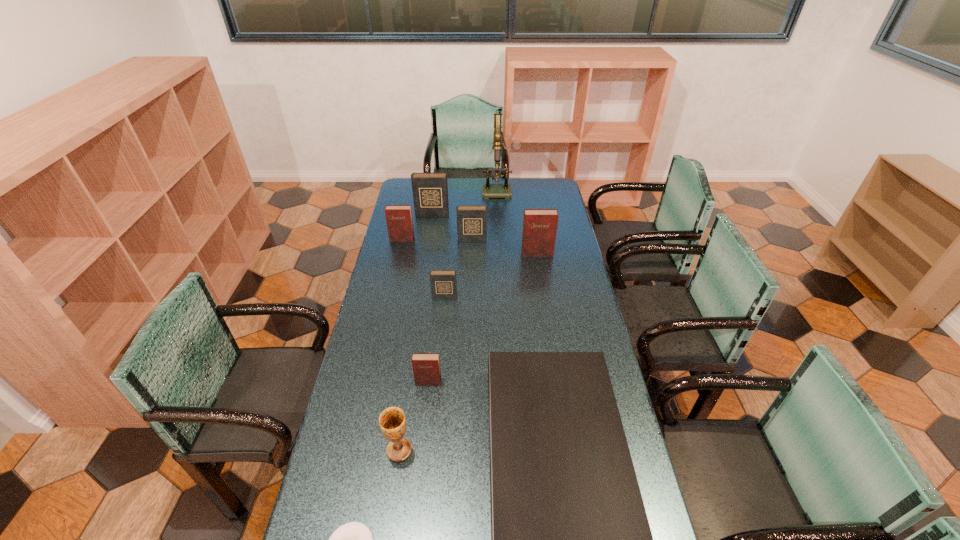
Identify the location of microscope. (489, 190).

Where is `brown microscope`? This screenshot has width=960, height=540. brown microscope is located at coordinates (489, 190).

Where is `the biggest dark diary`? Image resolution: width=960 pixels, height=540 pixels. the biggest dark diary is located at coordinates (430, 190).

What are the coordinates of `the farthest diary` in the screenshot? It's located at (430, 190).

Identify the location of the biggest reddish-brown diary. (539, 232).

The width and height of the screenshot is (960, 540). Identify the location of the second farthest reddish-brown diary. [x=539, y=232].

Locate an element on the screen. This screenshot has width=960, height=540. the leftmost reddish-brown diary is located at coordinates point(399,220).

This screenshot has width=960, height=540. I want to click on the second biggest reddish-brown diary, so click(399, 220).

Identify the location of the second nearest dark diary. This screenshot has width=960, height=540. (471, 220).

Identify the location of chalice. (392, 421).